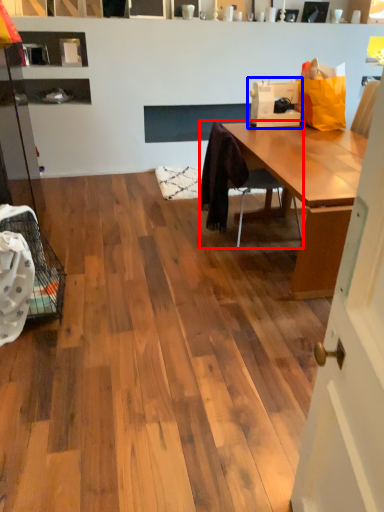
Question: Which object appears farthest to the camera in this image, chair (highlighted by a red box) or sewing machine (highlighted by a blue box)?

Choices:
 (A) chair
 (B) sewing machine

Answer: (B)